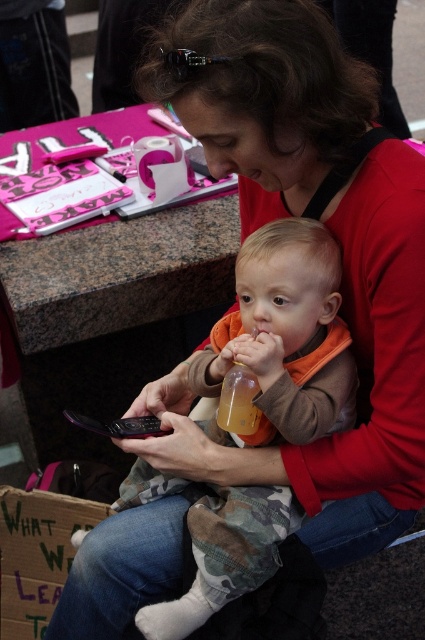
You are standing in front of the image and want to know how far the point at coordinates (272, 531) is from you. Can you determine the distance?

The distance between the point at coordinates (272, 531) and the viewer is 35.70 inches.

You are a delivery robot trying to place a package between the orange soft fabric baby at center and the translucent plastic bottle at center. The package is 5 inches long. Can you fit the package in the space between them?

The distance between the orange soft fabric baby at center and the translucent plastic bottle at center is 4.88 inches. Since the package is 5 inches long, it is slightly longer than the available space. Therefore, the package cannot fit between them.

You are a photographer standing at a certain distance from the orange soft fabric baby at center. You want to take a closeup photo of the baby while ensuring the baby remains in focus. Given that your camera has a minimum focusing distance of 30 inches, will you need to move closer or farther away from the baby?

The distance between the orange soft fabric baby at center and the camera is 34.63 inches. Since the camera can focus as close as 30 inches, you do not need to move closer. You can take the closeup photo from your current position because 34.63 inches is within the camera s minimum focusing distance range.